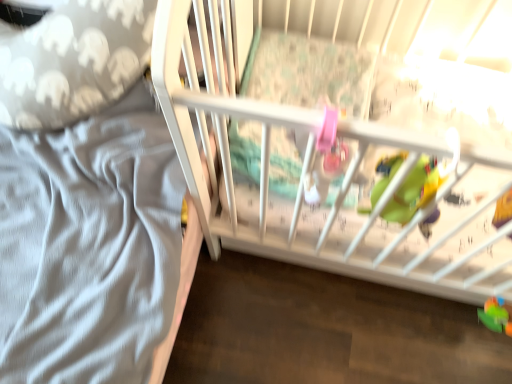
Question: Considering the relative sizes of green plastic toy at lower right, acting as the 2th toy starting from the top, and gray elephant-patterned pillow at left in the image provided, is green plastic toy at lower right, acting as the 2th toy starting from the top, bigger than gray elephant-patterned pillow at left?

Choices:
 (A) yes
 (B) no

Answer: (B)

Question: From a real-world perspective, is green plastic toy at lower right, acting as the 2th toy starting from the top, under gray elephant-patterned pillow at left?

Choices:
 (A) no
 (B) yes

Answer: (B)

Question: Considering the relative sizes of green plastic toy at lower right, arranged as the second toy when viewed from the front, and gray elephant-patterned pillow at left in the image provided, is green plastic toy at lower right, arranged as the second toy when viewed from the front, shorter than gray elephant-patterned pillow at left?

Choices:
 (A) no
 (B) yes

Answer: (B)

Question: Considering the relative sizes of green plastic toy at lower right, acting as the 2th toy starting from the top, and gray elephant-patterned pillow at left in the image provided, is green plastic toy at lower right, acting as the 2th toy starting from the top, smaller than gray elephant-patterned pillow at left?

Choices:
 (A) yes
 (B) no

Answer: (A)

Question: From the image's perspective, would you say green plastic toy at lower right, which appears as the first toy when ordered from the bottom, is shown under gray elephant-patterned pillow at left?

Choices:
 (A) no
 (B) yes

Answer: (B)

Question: Is green plastic toy at lower right, acting as the 2th toy starting from the top, not within gray elephant-patterned pillow at left?

Choices:
 (A) no
 (B) yes

Answer: (B)

Question: Does gray elephant-patterned pillow at left have a greater height compared to green plastic toy at lower right, which appears as the first toy when ordered from the bottom?

Choices:
 (A) no
 (B) yes

Answer: (B)

Question: Is gray elephant-patterned pillow at left located outside green plastic toy at lower right, which appears as the first toy when viewed from the back?

Choices:
 (A) yes
 (B) no

Answer: (A)

Question: Is gray elephant-patterned pillow at left next to green plastic toy at lower right, the 1th toy in the right-to-left sequence?

Choices:
 (A) no
 (B) yes

Answer: (A)

Question: Does gray elephant-patterned pillow at left appear on the left side of green plastic toy at lower right, acting as the 2th toy starting from the top?

Choices:
 (A) yes
 (B) no

Answer: (A)

Question: Does gray elephant-patterned pillow at left appear on the right side of green plastic toy at lower right, which appears as the first toy when viewed from the back?

Choices:
 (A) yes
 (B) no

Answer: (B)

Question: Can you confirm if gray elephant-patterned pillow at left is thinner than green plastic toy at lower right, which appears as the first toy when viewed from the back?

Choices:
 (A) no
 (B) yes

Answer: (A)

Question: Is rubberized green toy at lower right, acting as the 1th toy starting from the top, positioned far away from green plastic toy at lower right, which appears as the first toy when viewed from the back?

Choices:
 (A) no
 (B) yes

Answer: (A)